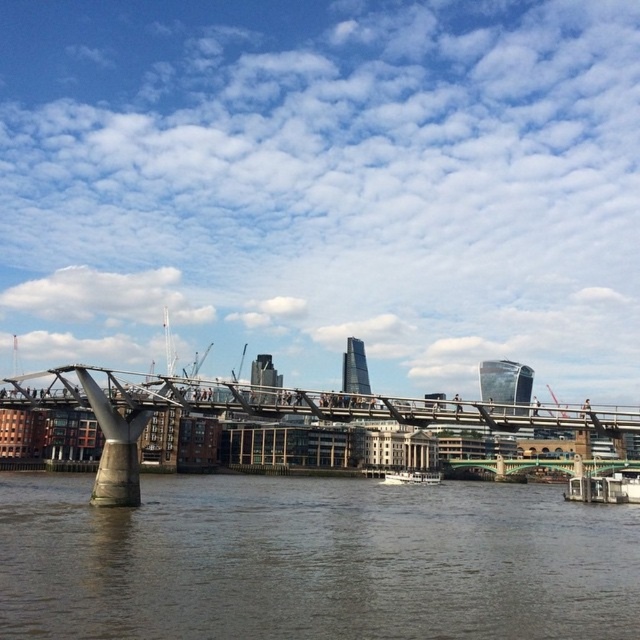
Based on the photo, you are a tourist standing on the Millennium Bridge in London. You see the brown concrete water at lower center and the white wooden boat at lower center. Which object is closer to you?

The brown concrete water at lower center is positioned over the white wooden boat at lower center, so the brown concrete water at lower center is closer to you.

You are a photographer planning to capture the entire view of the metallic gray bridge at center and the brown concrete water at lower center in a single photo. Based on the scene described, which object should you focus on to ensure both are visible without cropping? Explain your reasoning.

The brown concrete water at lower center is smaller than the metallic gray bridge at center. To capture both in a single photo without cropping, focus on the metallic gray bridge at center since it occupies a larger area, allowing the smaller brown concrete water at lower center to fit naturally within the frame.

You are a photographer planning to capture the entire Millennium Bridge and its surroundings in one shot. Given that your camera can only focus on objects within a 10m width, will the brown concrete water at lower center and the white wooden boat at lower center both fit within the camera frame?

The brown concrete water at lower center is wider than the white wooden boat at lower center. Since the camera can focus on objects within a 10m width, both objects will fit within the frame as their combined width is less than 10m.